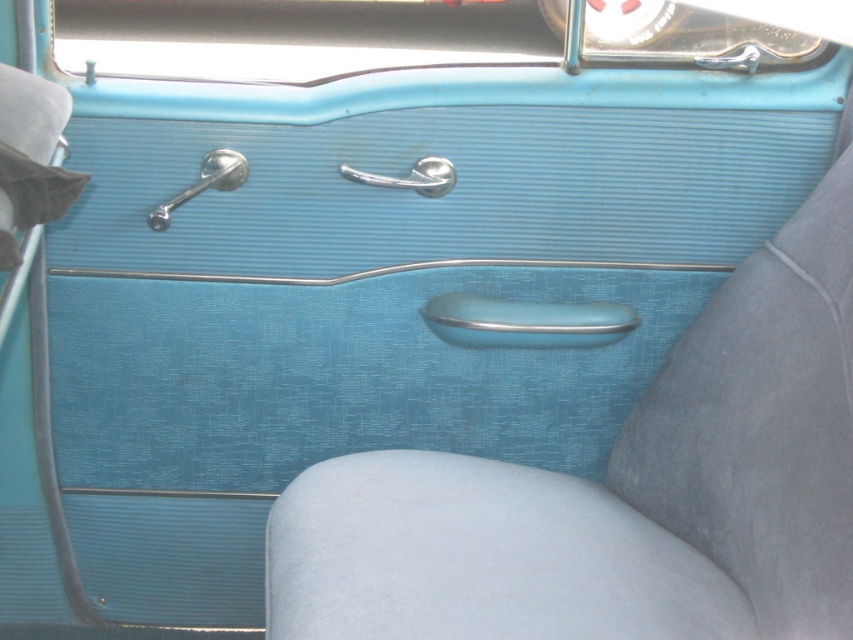
You are a car enthusiast examining the driver side door panel of a vintage car. You see the polished chrome door handle at upper left and the polished silver door handle at center. Which handle is positioned lower on the door panel?

The polished chrome door handle at upper left is located below the polished silver door handle at center, so it is positioned lower on the door panel.

You are a car enthusiast inspecting the vintage vehicle. You notice two handles on the driver side door panel. Which handle is bigger between the polished chrome door handle at upper left and the polished silver door handle at center?

The polished chrome door handle at upper left is larger in size than the polished silver door handle at center.

From the picture: You are a mechanic working on a vintage car and need to identify which door handle is taller. You see the metallic blue door handle at center and the polished silver door handle at center. Which one is taller?

The metallic blue door handle at center is taller than the polished silver door handle at center according to the description.